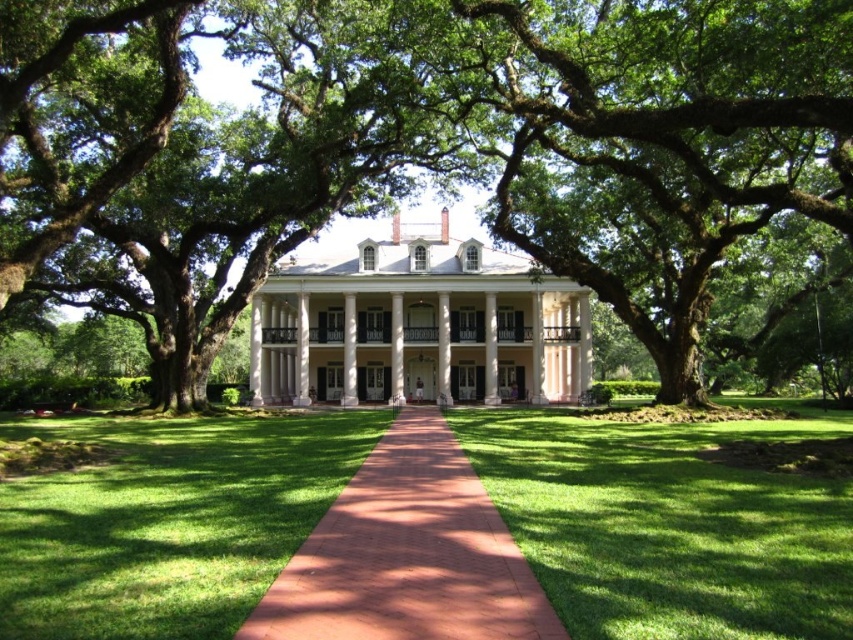
Question: Which point is closer to the camera?

Choices:
 (A) red brick pathway at center
 (B) green grass at center
 (C) white painted wood porch at center
 (D) green leafy tree at center

Answer: (A)

Question: Which point is farther to the camera?

Choices:
 (A) (181, 592)
 (B) (131, 13)
 (C) (329, 545)

Answer: (B)

Question: Among these objects, which one is nearest to the camera?

Choices:
 (A) green grass at center
 (B) green leafy tree at center
 (C) red brick pathway at center
 (D) white painted wood porch at center

Answer: (C)

Question: Where is green grass at center located in relation to white painted wood porch at center in the image?

Choices:
 (A) above
 (B) below

Answer: (B)

Question: Can you confirm if green leafy tree at center is smaller than white painted wood porch at center?

Choices:
 (A) yes
 (B) no

Answer: (B)

Question: Is green grass at center thinner than red brick pathway at center?

Choices:
 (A) no
 (B) yes

Answer: (A)